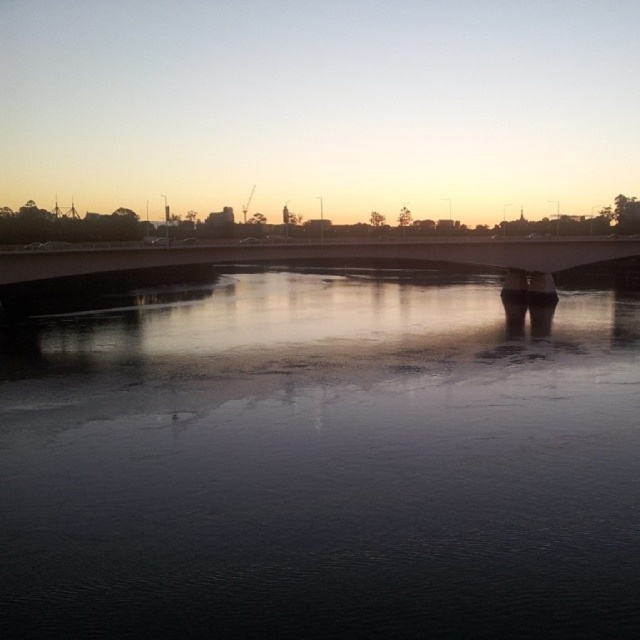
Does dark reflective water at center come behind white concrete bridge at center?

No, dark reflective water at center is closer to the viewer.

Looking at this image, can you confirm if dark reflective water at center is taller than white concrete bridge at center?

In fact, dark reflective water at center may be shorter than white concrete bridge at center.

Who is more distant from viewer, (502, 579) or (285, 250)?

Positioned behind is point (285, 250).

The image size is (640, 640). What are the coordinates of `dark reflective water at center` in the screenshot? It's located at click(x=323, y=465).